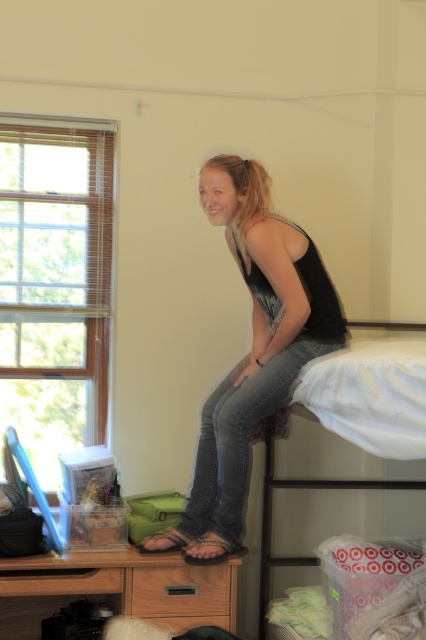
Question: Is black matte tank top at upper center bigger than white fabric bunk bed at upper right?

Choices:
 (A) yes
 (B) no

Answer: (A)

Question: Is the position of black matte tank top at upper center less distant than that of white fabric bunk bed at upper right?

Choices:
 (A) yes
 (B) no

Answer: (A)

Question: Which object appears farthest from the camera in this image?

Choices:
 (A) white fabric bunk bed at upper right
 (B) black matte tank top at upper center

Answer: (A)

Question: Among these objects, which one is farthest from the camera?

Choices:
 (A) white fabric bunk bed at upper right
 (B) black matte tank top at upper center

Answer: (A)

Question: In this image, where is black matte tank top at upper center located relative to white fabric bunk bed at upper right?

Choices:
 (A) right
 (B) left

Answer: (B)